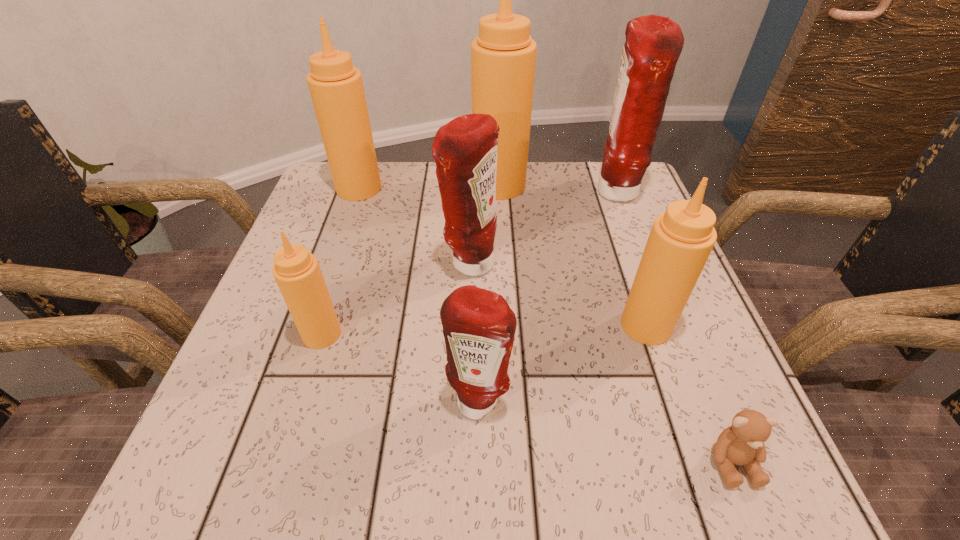
What are the coordinates of `object at the near edge` in the screenshot? It's located at (742, 443).

At what (x,y) coordinates should I click in order to perform the action: click on teddy bear at the right edge. Please return your answer as a coordinate pair (x, y). This screenshot has width=960, height=540. Looking at the image, I should click on (742, 443).

At what (x,y) coordinates should I click in order to perform the action: click on object situated at the far left corner. Please return your answer as a coordinate pair (x, y). This screenshot has height=540, width=960. Looking at the image, I should click on (336, 87).

The width and height of the screenshot is (960, 540). I want to click on object that is at the far right corner, so click(x=653, y=45).

The height and width of the screenshot is (540, 960). I want to click on object that is at the near right corner, so click(742, 443).

Locate an element on the screen. This screenshot has width=960, height=540. vacant space at the far edge of the desktop is located at coordinates (573, 182).

In the image, there is a desktop. What are the coordinates of `free space at the left edge` in the screenshot? It's located at (358, 266).

Where is `vacant space at the right edge`? vacant space at the right edge is located at coordinates click(x=692, y=305).

Where is `free point at the near left corner`? This screenshot has width=960, height=540. free point at the near left corner is located at coordinates (261, 473).

At what (x,y) coordinates should I click in order to perform the action: click on blank space at the far right corner. Please return your answer as a coordinate pair (x, y). Looking at the image, I should click on (620, 217).